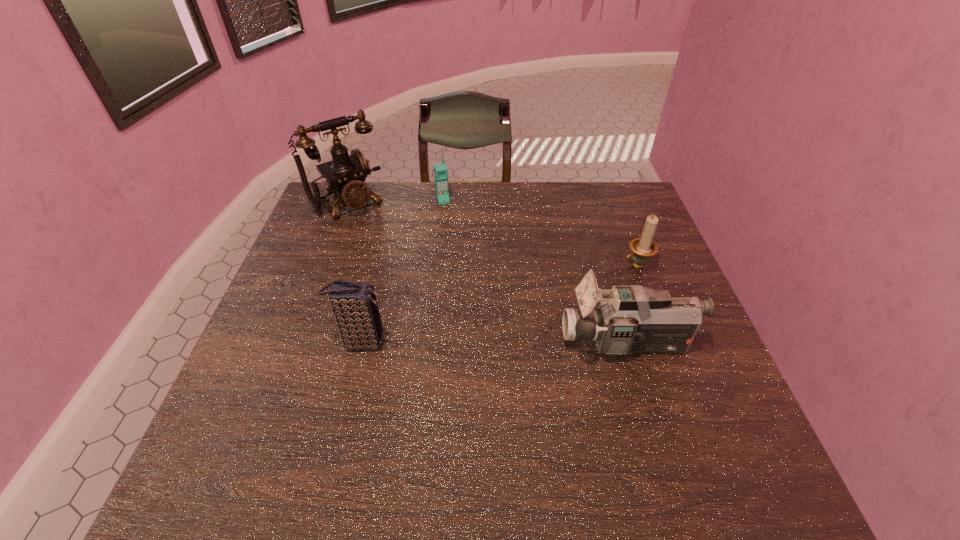
Locate an element on the screen. clutch bag is located at coordinates (355, 310).

Where is `camcorder`? The image size is (960, 540). camcorder is located at coordinates (633, 319).

I want to click on candle_holder, so pos(643,248).

Where is `the third object from left to right`? The width and height of the screenshot is (960, 540). the third object from left to right is located at coordinates (440, 169).

I want to click on the tallest object, so click(x=345, y=174).

Image resolution: width=960 pixels, height=540 pixels. Find the location of `blank space located 0.210m with the zip open on the clutch bag`. blank space located 0.210m with the zip open on the clutch bag is located at coordinates (479, 343).

This screenshot has width=960, height=540. Identify the location of vacant space located on the front-facing side of the camcorder. (459, 343).

At what (x,y) coordinates should I click in order to perform the action: click on vacant space located on the front-facing side of the camcorder. Please return your answer as a coordinate pair (x, y). The height and width of the screenshot is (540, 960). Looking at the image, I should click on (420, 343).

Locate an element on the screen. The image size is (960, 540). vacant space located 0.270m on the front-facing side of the camcorder is located at coordinates (445, 343).

This screenshot has width=960, height=540. I want to click on vacant region located 0.220m on the handle side of the third nearest object, so click(x=559, y=300).